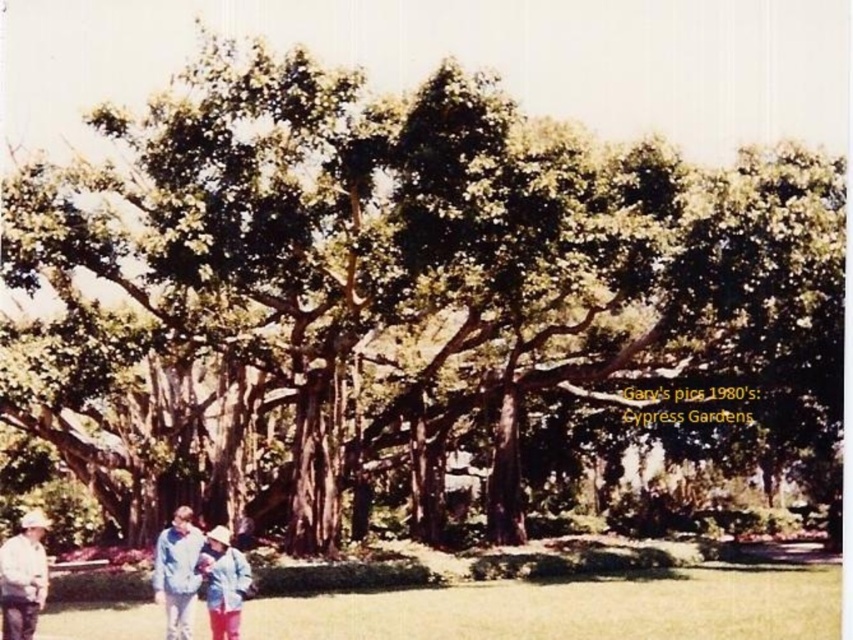
You are standing at point (236, 609) and want to walk to point (21, 602). Is the destination point behind you or in front of you?

The destination point (21, 602) is behind your current position at (236, 609).

You are a photographer setting up a tripod in the grassy area near the Cypress Gardens tree. You notice two people wearing the light blue denim jacket at lower left and the white cotton shirt at lower left. Which clothing item is narrower in width?

The light blue denim jacket at lower left is narrower in width compared to the white cotton shirt at lower left.

You are standing at the center of the grassy area in the scene. You want to find the white cotton shirt at lower left. Which direction should you look to locate it?

The white cotton shirt at lower left is located at point (x=22, y=577), which is to the lower left direction from your current position at the center of the grassy area.